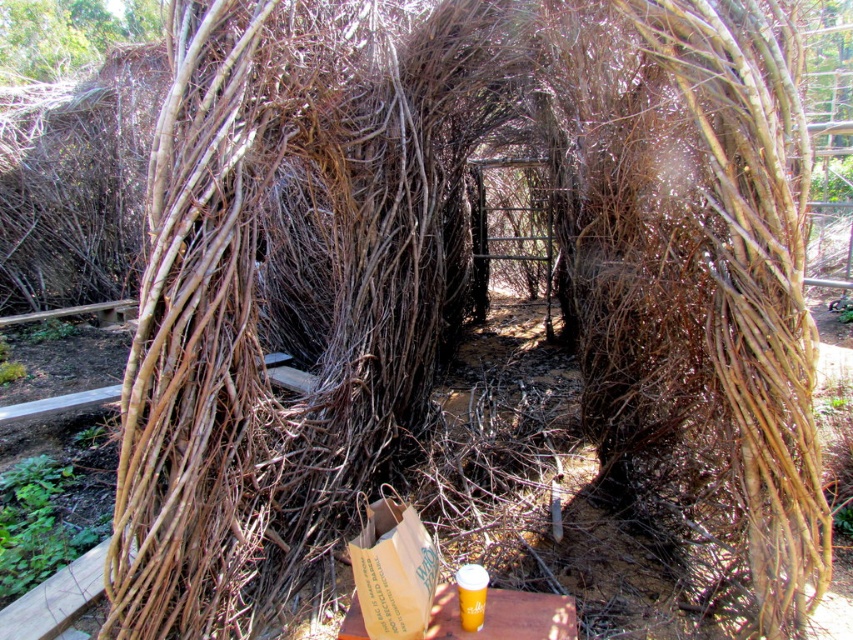
You are standing at the entrance of the rustic tunnel and see a brown wood table at lower center and a translucent plastic cup at center. Which object is closer to you as you face the tunnel entrance?

The brown wood table at lower center is closer to you because the translucent plastic cup at center is behind it.

You are a hiker carrying a brown paper bag at lower center and a brown wood table at lower center. Which object is bigger?

The brown paper bag at lower center is larger in size compared to the brown wood table at lower center according to the description.